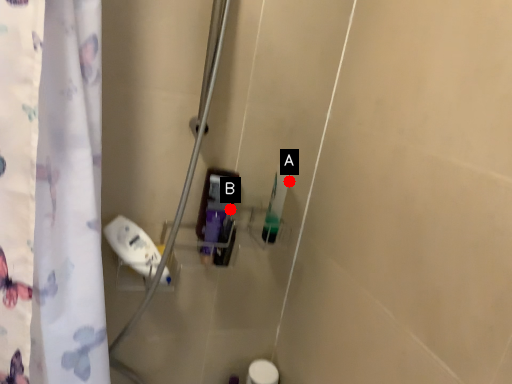
Question: Two points are circled on the image, labeled by A and B beside each circle. Which point is farther from the camera taking this photo?

Choices:
 (A) A is further
 (B) B is further

Answer: (A)